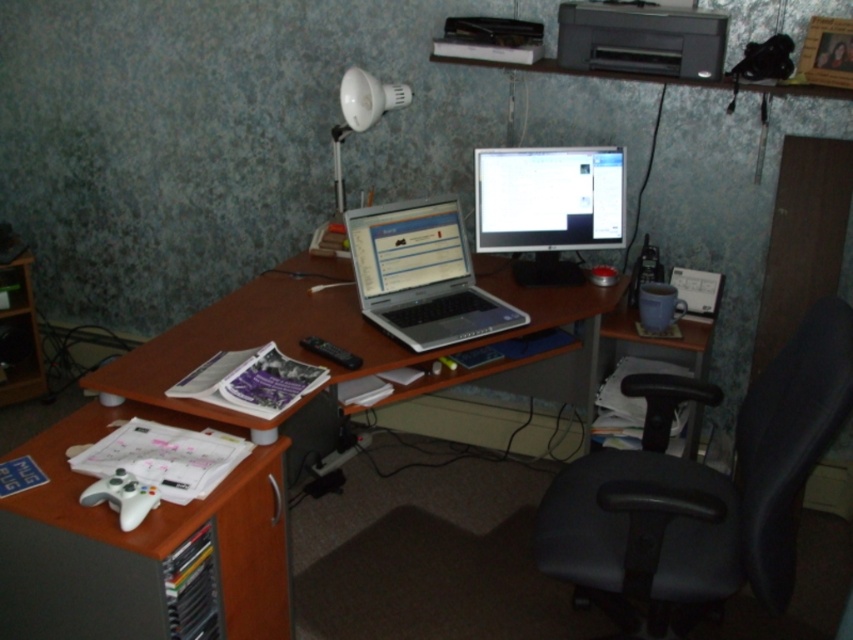
Question: Considering the relative positions of black leather swivel chair at lower right and matte gray printer at upper right in the image provided, where is black leather swivel chair at lower right located with respect to matte gray printer at upper right?

Choices:
 (A) below
 (B) above

Answer: (A)

Question: Is black leather swivel chair at lower right behind matte black monitor at center?

Choices:
 (A) no
 (B) yes

Answer: (A)

Question: Which point is closer to the camera taking this photo?

Choices:
 (A) (582, 380)
 (B) (97, 630)
 (C) (587, 172)
 (D) (360, 308)

Answer: (B)

Question: Which object is closer to the camera taking this photo?

Choices:
 (A) black leather swivel chair at lower right
 (B) brown wood desk at center
 (C) matte black monitor at center
 (D) silver/black laptop at center

Answer: (A)

Question: Which point is closer to the camera taking this photo?

Choices:
 (A) (573, 225)
 (B) (703, 67)
 (C) (274, 324)
 (D) (140, 547)

Answer: (D)

Question: Considering the relative positions of silver/black laptop at center and matte gray printer at upper right in the image provided, where is silver/black laptop at center located with respect to matte gray printer at upper right?

Choices:
 (A) left
 (B) right

Answer: (A)